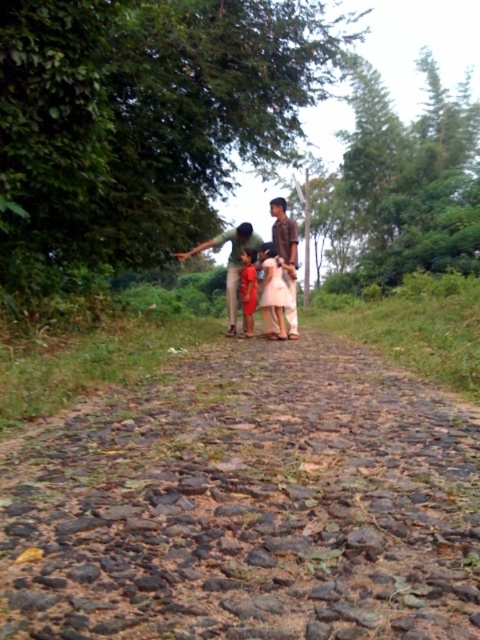
Question: Estimate the real-world distances between objects in this image. Which object is closer to the brown cotton shirt at center?

Choices:
 (A) matte red dress at center
 (B) green matte shirt at center
 (C) brown gravel path at center

Answer: (A)

Question: Can you confirm if brown cotton shirt at center is thinner than matte red dress at center?

Choices:
 (A) yes
 (B) no

Answer: (B)

Question: From the image, what is the correct spatial relationship of brown gravel path at center in relation to white satin dress at center?

Choices:
 (A) left
 (B) right

Answer: (B)

Question: Is green matte shirt at center smaller than matte red dress at center?

Choices:
 (A) yes
 (B) no

Answer: (B)

Question: Which point is farther to the camera?

Choices:
 (A) brown cotton shirt at center
 (B) brown gravel path at center

Answer: (A)

Question: Which of the following is the farthest from the observer?

Choices:
 (A) brown cotton shirt at center
 (B) matte red dress at center

Answer: (B)